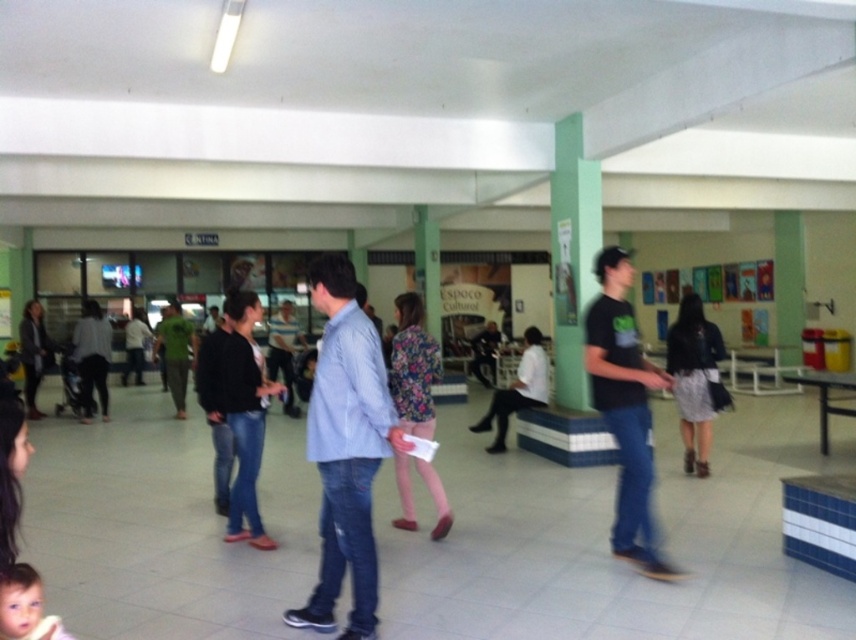
From the picture: Does jeans at center have a greater width compared to smooth skin baby at lower left?

Correct, the width of jeans at center exceeds that of smooth skin baby at lower left.

I want to click on jeans at center, so click(x=241, y=408).

Can you confirm if dark gray textured dress at center is positioned to the right of white shirt at center?

Correct, you'll find dark gray textured dress at center to the right of white shirt at center.

Between dark gray textured dress at center and white shirt at center, which one is positioned lower?

Positioned lower is white shirt at center.

Who is more forward, (702, 452) or (492, 449)?

Point (702, 452) is more forward.

Image resolution: width=856 pixels, height=640 pixels. I want to click on dark gray textured dress at center, so click(x=694, y=378).

Describe the element at coordinates (345, 448) in the screenshot. The width and height of the screenshot is (856, 640). I see `light blue denim jeans at center` at that location.

Between light blue denim jeans at center and matte black shirt at center, which one is positioned higher?

matte black shirt at center is above.

The width and height of the screenshot is (856, 640). In order to click on light blue denim jeans at center in this screenshot , I will do pos(345,448).